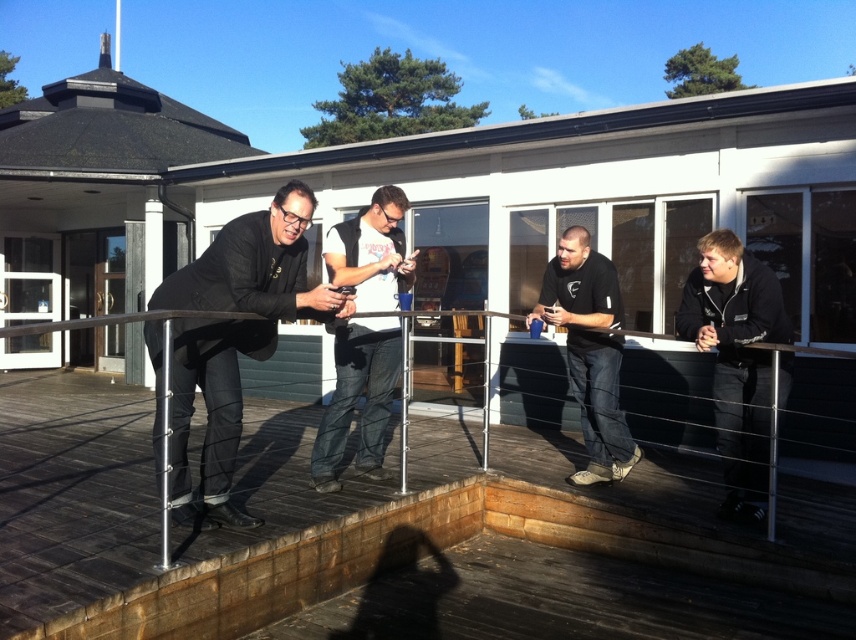
Does black fleece jacket at right appear on the right side of black matte shirt at center?

Correct, you'll find black fleece jacket at right to the right of black matte shirt at center.

You are a GUI agent. You are given a task and a screenshot of the screen. Output one action in this format:
    pyautogui.click(x=<x>, y=<y>)
    Task: Click on the black fleece jacket at right
    This screenshot has width=856, height=640.
    Given the screenshot: What is the action you would take?
    click(736, 360)

Is wooden deck at center above black matte shirt at center?

No, wooden deck at center is not above black matte shirt at center.

Does point (27, 636) lie behind point (574, 225)?

No, (27, 636) is closer to viewer.

Does point (412, 426) come farther from viewer compared to point (586, 230)?

Yes, it is behind point (586, 230).

Locate an element on the screen. The height and width of the screenshot is (640, 856). wooden deck at center is located at coordinates (388, 538).

Is point (411, 480) positioned after point (373, 477)?

Yes, it is behind point (373, 477).

Does wooden deck at center have a lesser height compared to white cotton t-shirt at center?

Indeed, wooden deck at center has a lesser height compared to white cotton t-shirt at center.

Is point (30, 602) farther from viewer compared to point (342, 221)?

That is False.

Where is `wooden deck at center`? Image resolution: width=856 pixels, height=640 pixels. wooden deck at center is located at coordinates (388, 538).